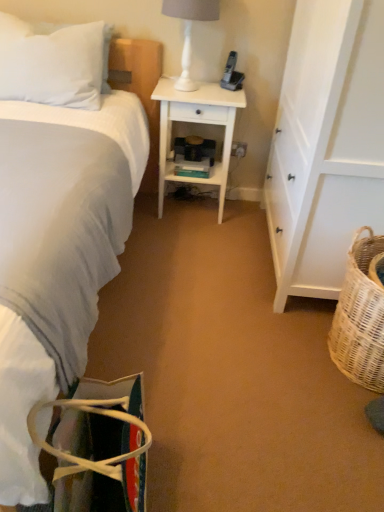
Where is `vacant space in between white glossy lamp at upper center and black plastic phone at upper center`? The height and width of the screenshot is (512, 384). vacant space in between white glossy lamp at upper center and black plastic phone at upper center is located at coordinates (216, 90).